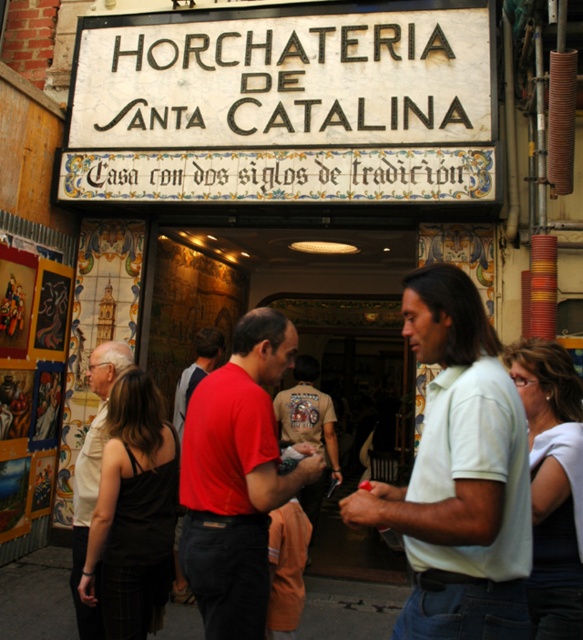
Question: Does matte red shirt at center appear over red shirt at center?

Choices:
 (A) yes
 (B) no

Answer: (B)

Question: Considering the real-world distances, which object is closest to the red shirt at center?

Choices:
 (A) matte red shirt at center
 (B) khaki cotton shirt at center
 (C) white painted wood sign at upper center
 (D) light beige shirt at center

Answer: (B)

Question: Does white painted wood sign at upper center have a larger size compared to matte red shirt at center?

Choices:
 (A) no
 (B) yes

Answer: (B)

Question: Which object is the farthest from the light green cotton shirt at center?

Choices:
 (A) white painted wood sign at upper center
 (B) light beige shirt at center

Answer: (A)

Question: Is white painted wood sign at upper center smaller than red shirt at center?

Choices:
 (A) no
 (B) yes

Answer: (A)

Question: Which object appears farthest from the camera in this image?

Choices:
 (A) black fabric at center
 (B) light beige shirt at center
 (C) khaki cotton shirt at center
 (D) light green cotton shirt at center

Answer: (C)